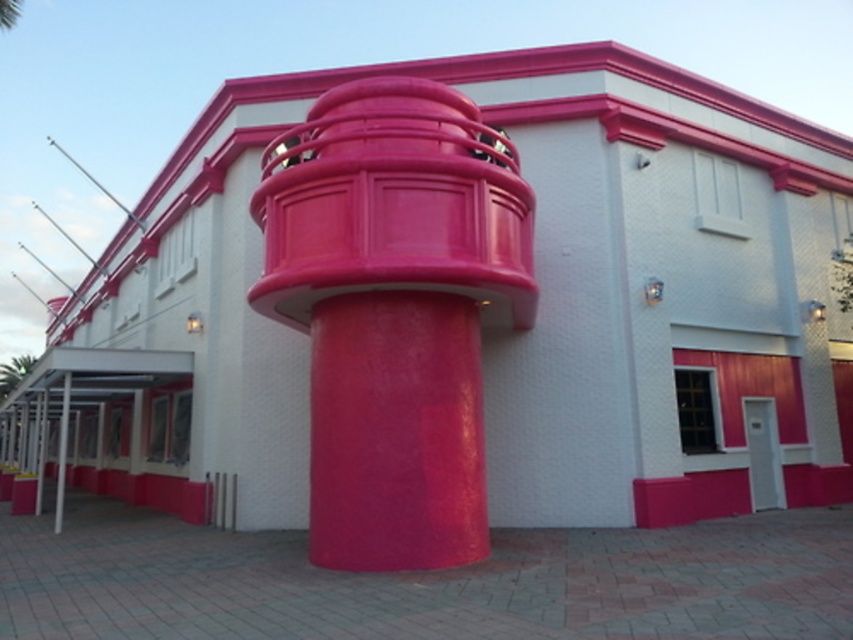
You are standing in front of the building and want to determine the relative positions of two points marked on the facade. Which point is closer to you, point (329, 250) or point (61, 502)?

Point (329, 250) is closer to the viewer than point (61, 502).